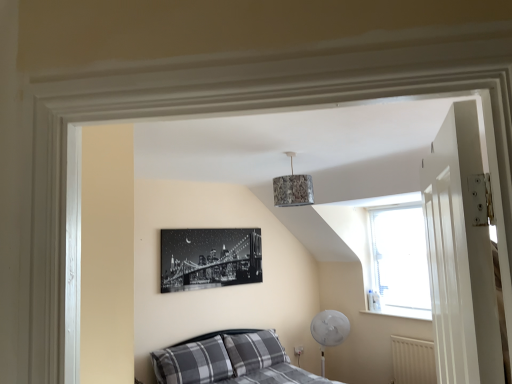
Question: Does plaid fabric pillow at lower left, which is counted as the first pillow, starting from the left, have a larger size compared to white textured radiator at lower right?

Choices:
 (A) no
 (B) yes

Answer: (B)

Question: Would you say plaid fabric pillow at lower left, positioned as the 2th pillow in right-to-left order, contains white textured radiator at lower right?

Choices:
 (A) yes
 (B) no

Answer: (B)

Question: Is plaid fabric pillow at lower left, positioned as the 2th pillow in right-to-left order, turned away from white textured radiator at lower right?

Choices:
 (A) no
 (B) yes

Answer: (A)

Question: Is plaid fabric pillow at lower left, positioned as the 2th pillow in right-to-left order, thinner than white textured radiator at lower right?

Choices:
 (A) yes
 (B) no

Answer: (B)

Question: Is plaid fabric pillow at lower left, positioned as the 2th pillow in right-to-left order, shorter than white textured radiator at lower right?

Choices:
 (A) yes
 (B) no

Answer: (B)

Question: From a real-world perspective, does plaid fabric pillow at lower left, positioned as the 2th pillow in right-to-left order, sit lower than white textured radiator at lower right?

Choices:
 (A) no
 (B) yes

Answer: (A)

Question: From a real-world perspective, does white smooth window sill at lower right stand above transparent glass window at upper right?

Choices:
 (A) no
 (B) yes

Answer: (A)

Question: Considering the relative positions of white smooth window sill at lower right and transparent glass window at upper right in the image provided, is white smooth window sill at lower right to the left of transparent glass window at upper right from the viewer's perspective?

Choices:
 (A) no
 (B) yes

Answer: (B)

Question: Is transparent glass window at upper right located within white smooth window sill at lower right?

Choices:
 (A) no
 (B) yes

Answer: (A)

Question: Is white smooth window sill at lower right positioned in front of transparent glass window at upper right?

Choices:
 (A) yes
 (B) no

Answer: (A)

Question: From the image's perspective, would you say white smooth window sill at lower right is shown under transparent glass window at upper right?

Choices:
 (A) no
 (B) yes

Answer: (B)

Question: Considering the relative sizes of white smooth window sill at lower right and transparent glass window at upper right in the image provided, is white smooth window sill at lower right wider than transparent glass window at upper right?

Choices:
 (A) yes
 (B) no

Answer: (A)

Question: Does plaid fabric pillow at lower left, positioned as the 2th pillow in right-to-left order, have a smaller size compared to transparent glass window at upper right?

Choices:
 (A) yes
 (B) no

Answer: (B)